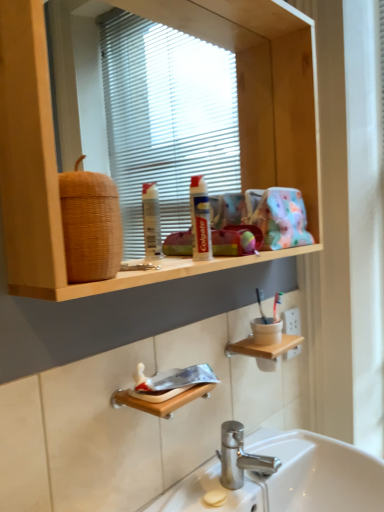
Question: Does white glossy sink at lower center appear on the left side of wooden shelf at upper center?

Choices:
 (A) no
 (B) yes

Answer: (A)

Question: Is white glossy sink at lower center facing away from wooden shelf at upper center?

Choices:
 (A) yes
 (B) no

Answer: (B)

Question: Is white glossy sink at lower center facing towards wooden shelf at upper center?

Choices:
 (A) no
 (B) yes

Answer: (A)

Question: From the image's perspective, is white glossy sink at lower center on top of wooden shelf at upper center?

Choices:
 (A) yes
 (B) no

Answer: (B)

Question: Is white glossy sink at lower center beside wooden shelf at upper center?

Choices:
 (A) yes
 (B) no

Answer: (B)

Question: Is wooden shelf at upper center completely or partially inside white glossy sink at lower center?

Choices:
 (A) no
 (B) yes

Answer: (A)

Question: Are wooden shelf at lower center and woven brown basket at upper left located far from each other?

Choices:
 (A) yes
 (B) no

Answer: (B)

Question: Does wooden shelf at lower center have a greater height compared to woven brown basket at upper left?

Choices:
 (A) yes
 (B) no

Answer: (B)

Question: Is wooden shelf at lower center further to the viewer compared to woven brown basket at upper left?

Choices:
 (A) yes
 (B) no

Answer: (A)

Question: Does wooden shelf at lower center have a greater width compared to woven brown basket at upper left?

Choices:
 (A) no
 (B) yes

Answer: (B)

Question: From a real-world perspective, is wooden shelf at lower center physically below woven brown basket at upper left?

Choices:
 (A) yes
 (B) no

Answer: (A)

Question: Considering the relative sizes of wooden shelf at lower center and woven brown basket at upper left in the image provided, is wooden shelf at lower center smaller than woven brown basket at upper left?

Choices:
 (A) yes
 (B) no

Answer: (A)

Question: Is white glossy sink at lower center outside wooden shelf at lower center?

Choices:
 (A) no
 (B) yes

Answer: (B)